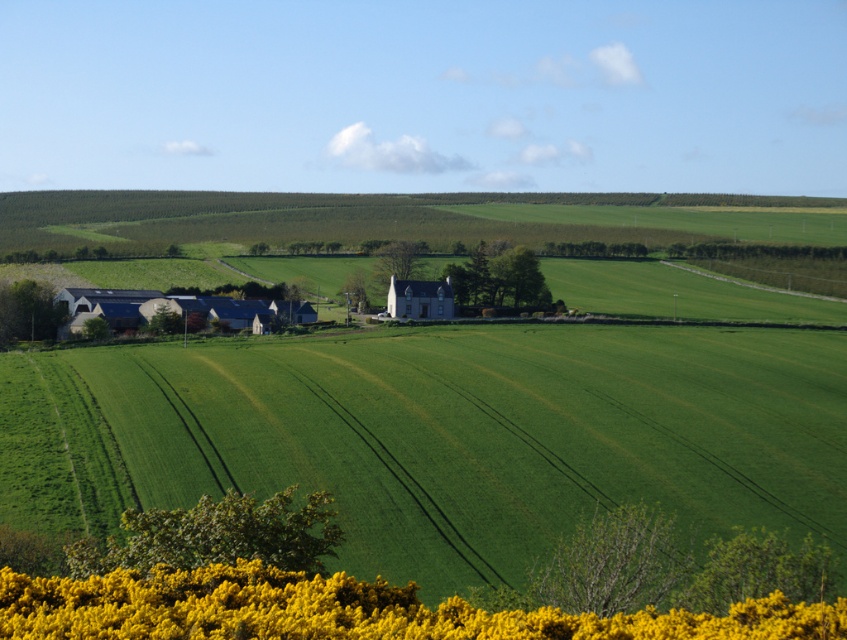
You are standing at the point with coordinates (380, 579) and want to walk towards the point with coordinates (551, 513). Will the point you are currently standing at block your view of the destination point?

Point (551, 513) is behind point (380, 579), so the point you are standing at will block your view of the destination point.

Based on the scene described, where is the green grassy field at center located in terms of coordinates?

The green grassy field at center is located at coordinates point (441, 435).